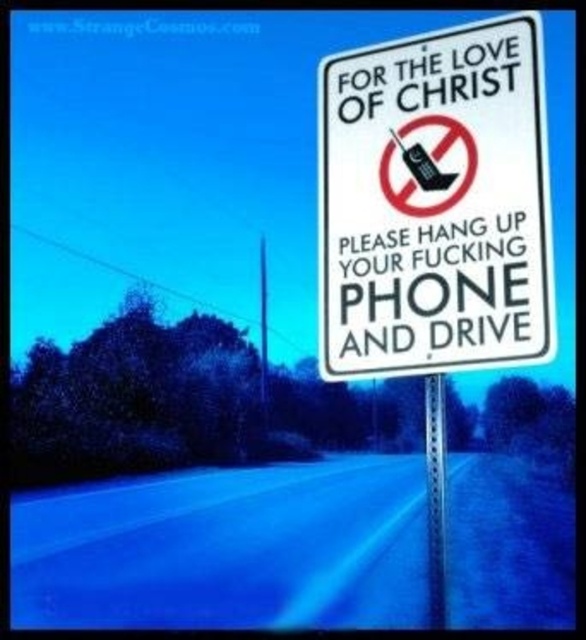
What do you see at coordinates (435, 204) in the screenshot? Image resolution: width=586 pixels, height=640 pixels. I see `white paper sign at upper right` at bounding box center [435, 204].

Is point (517, 307) farther from viewer compared to point (441, 545)?

That is False.

Identify the location of white paper sign at upper right. (435, 204).

Locate an element on the screen. white paper sign at upper right is located at coordinates (435, 204).